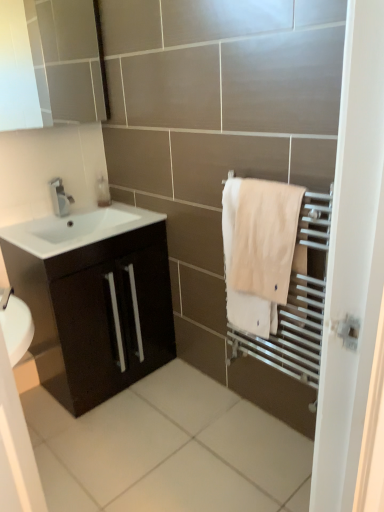
Question: Would you say beige cotton towel at right is to the left or to the right of satin nickel faucet at upper left in the picture?

Choices:
 (A) left
 (B) right

Answer: (B)

Question: Considering their positions, is beige cotton towel at right located in front of or behind satin nickel faucet at upper left?

Choices:
 (A) behind
 (B) front

Answer: (B)

Question: Estimate the real-world distances between objects in this image. Which object is closer to the translucent plastic soap dispenser at upper left?

Choices:
 (A) white glossy medicine cabinet at upper left
 (B) matte dark brown cabinet at left
 (C) white glossy sink at lower left
 (D) satin nickel faucet at upper left
 (E) beige cotton towel at right

Answer: (D)

Question: Which is farther from the white glossy sink at lower left?

Choices:
 (A) translucent plastic soap dispenser at upper left
 (B) white glossy medicine cabinet at upper left
 (C) matte dark brown cabinet at left
 (D) beige cotton towel at right
 (E) satin nickel faucet at upper left

Answer: (D)